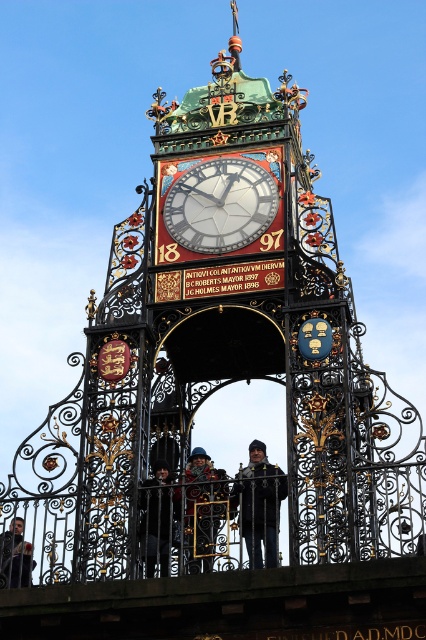
Does wrought iron gate at center appear over dark gray jacket at lower left?

Indeed, wrought iron gate at center is positioned over dark gray jacket at lower left.

Between wrought iron gate at center and dark gray jacket at lower left, which one appears on the right side from the viewer's perspective?

wrought iron gate at center is more to the right.

Between point (167, 449) and point (9, 579), which one is positioned behind?

The point (167, 449) is more distant.

Locate an element on the screen. The width and height of the screenshot is (426, 640). wrought iron gate at center is located at coordinates (129, 490).

Consider the image. Does dark blue fabric coat at center lie in front of dark blue fabric jacket at center?

Yes.

Can you confirm if dark blue fabric coat at center is thinner than dark blue fabric jacket at center?

Incorrect, dark blue fabric coat at center's width is not less than dark blue fabric jacket at center's.

Does point (204, 538) come in front of point (268, 467)?

Yes, it is.

Identify the location of dark blue fabric coat at center. (204, 513).

Is dark blue fabric coat at center positioned at the back of dark gray jacket at lower left?

No, it is not.

Can you confirm if dark blue fabric coat at center is positioned to the right of dark gray jacket at lower left?

Correct, you'll find dark blue fabric coat at center to the right of dark gray jacket at lower left.

What are the coordinates of `dark blue fabric coat at center` in the screenshot? It's located at (204, 513).